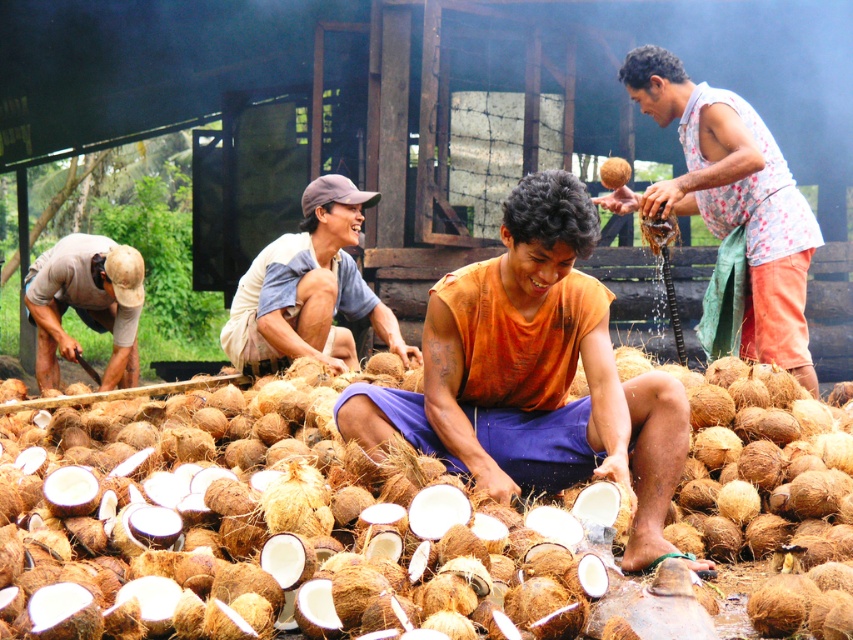
Is point (126, 490) less distant than point (529, 333)?

Yes, it is in front of point (529, 333).

Looking at this image, which is below, brown rough coconut at center or orange fabric at center?

brown rough coconut at center is below.

Which is in front, point (270, 600) or point (431, 401)?

Point (270, 600)

This screenshot has width=853, height=640. What are the coordinates of `brown rough coconut at center` in the screenshot? It's located at (286, 518).

This screenshot has width=853, height=640. Describe the element at coordinates (534, 372) in the screenshot. I see `orange fabric at center` at that location.

Between orange fabric at center and brown woven hat at center, which one appears on the left side from the viewer's perspective?

Positioned to the left is brown woven hat at center.

Does point (363, 396) come closer to viewer compared to point (346, 188)?

Yes, it is in front of point (346, 188).

You are a GUI agent. You are given a task and a screenshot of the screen. Output one action in this format:
    pyautogui.click(x=<x>, y=<y>)
    Task: Click on the orange fabric at center
    This screenshot has width=853, height=640.
    Given the screenshot: What is the action you would take?
    pyautogui.click(x=534, y=372)

How far apart are floral fabric shirt at upper right and brown woven hat at center?

1.60 meters

The width and height of the screenshot is (853, 640). Describe the element at coordinates (730, 198) in the screenshot. I see `floral fabric shirt at upper right` at that location.

Is point (791, 324) closer to viewer compared to point (270, 257)?

Yes, point (791, 324) is closer to viewer.

Where is `floral fabric shirt at upper right`? floral fabric shirt at upper right is located at coordinates (730, 198).